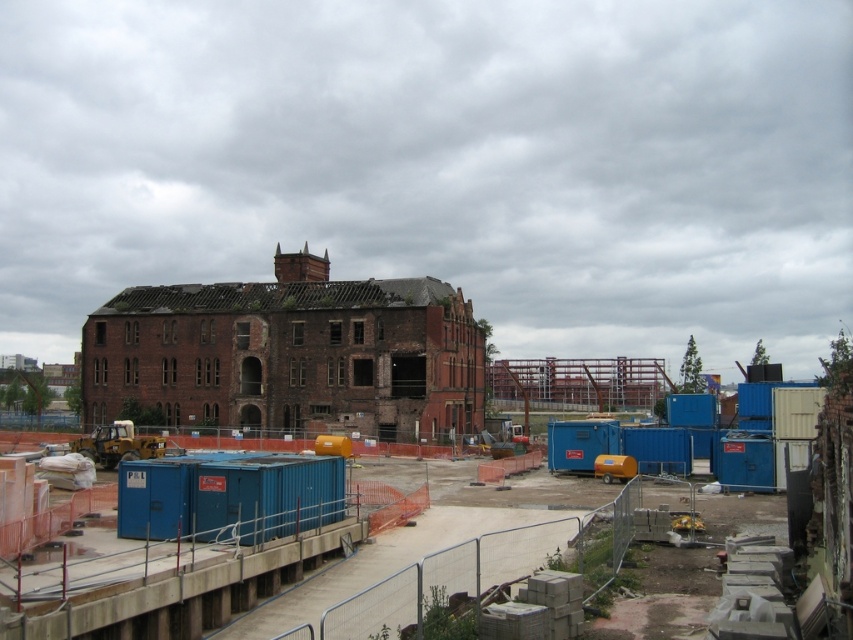
Question: Considering the relative positions of blue metallic containers at center and red brick building at center in the image provided, where is blue metallic containers at center located with respect to red brick building at center?

Choices:
 (A) left
 (B) right

Answer: (B)

Question: Is blue metallic containers at center thinner than red brick building at center?

Choices:
 (A) yes
 (B) no

Answer: (A)

Question: Is blue metallic containers at center further to camera compared to red brick building at center?

Choices:
 (A) yes
 (B) no

Answer: (B)